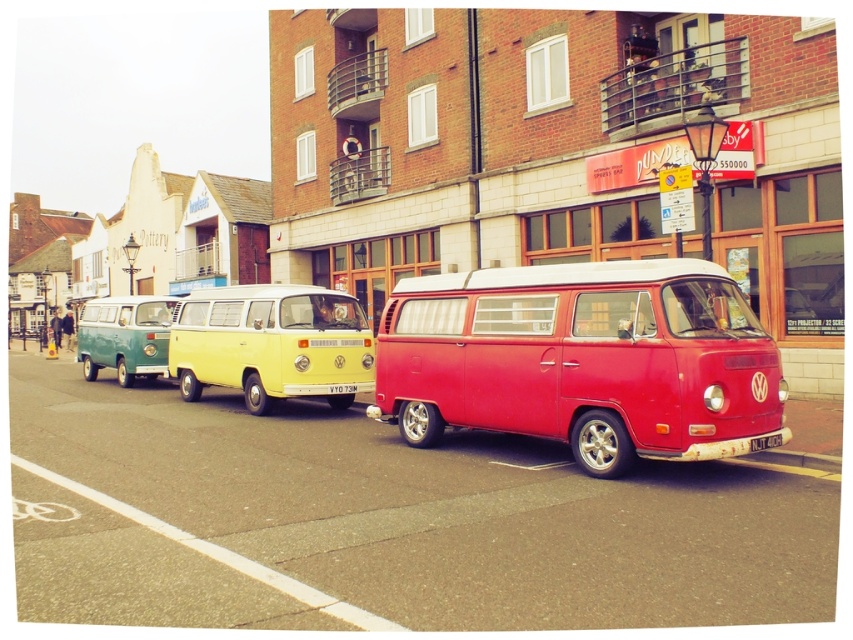
Question: Considering the real-world distances, which object is closest to the shiny red van at center?

Choices:
 (A) pastel yellow van at center
 (B) teal matte van at left

Answer: (A)

Question: Does pastel yellow van at center have a larger size compared to teal matte van at left?

Choices:
 (A) no
 (B) yes

Answer: (A)

Question: Which point appears farthest from the camera in this image?

Choices:
 (A) (108, 323)
 (B) (189, 397)

Answer: (A)

Question: Is shiny red van at center positioned before pastel yellow van at center?

Choices:
 (A) yes
 (B) no

Answer: (A)

Question: Which object is positioned closest to the teal matte van at left?

Choices:
 (A) pastel yellow van at center
 (B) shiny red van at center

Answer: (A)

Question: Can you confirm if shiny red van at center is bigger than pastel yellow van at center?

Choices:
 (A) yes
 (B) no

Answer: (B)